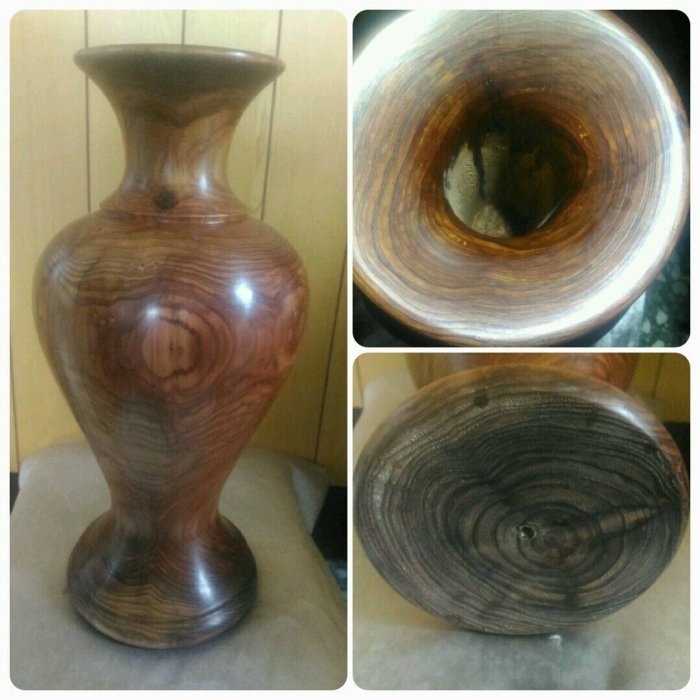
At what (x,y) coordinates should I click in order to perform the action: click on beige wall. Please return your answer as a coordinate pair (x, y). Looking at the image, I should click on (29, 370).